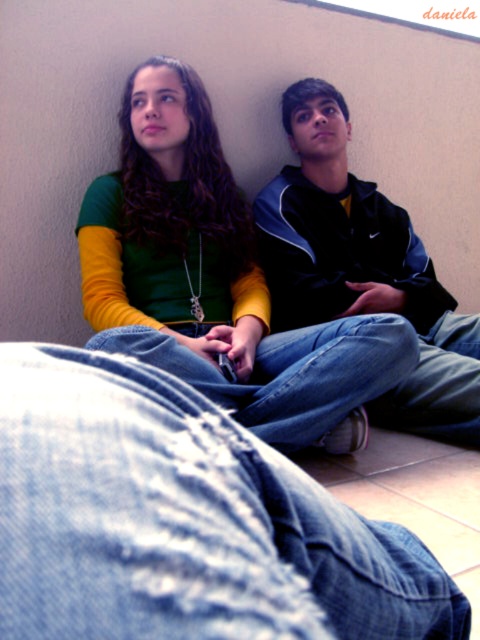
Between blue denim jeans at center and denim at lower right, which one is positioned higher?

blue denim jeans at center

Is blue denim jeans at center taller than denim at lower right?

Indeed, blue denim jeans at center has a greater height compared to denim at lower right.

Who is more forward, (x=379, y=397) or (x=431, y=397)?

Point (x=431, y=397)

I want to click on blue denim jeans at center, so click(x=362, y=266).

Image resolution: width=480 pixels, height=640 pixels. What do you see at coordinates (217, 275) in the screenshot?
I see `matte green shirt at upper left` at bounding box center [217, 275].

Between point (145, 179) and point (475, 355), which one is positioned in front?

Point (145, 179) is in front.

The image size is (480, 640). I want to click on matte green shirt at upper left, so click(x=217, y=275).

Can you confirm if denim jeans at center is positioned to the right of blue denim jeans at center?

No, denim jeans at center is not to the right of blue denim jeans at center.

Is denim jeans at center above blue denim jeans at center?

Actually, denim jeans at center is below blue denim jeans at center.

Which is in front, point (67, 480) or point (434, 348)?

Point (67, 480) is more forward.

Where is `denim jeans at center`? denim jeans at center is located at coordinates (183, 520).